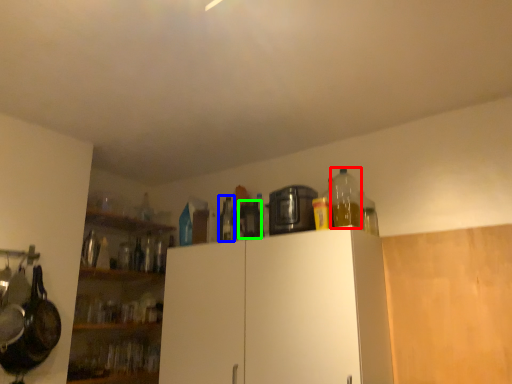
Question: Based on their relative distances, which object is nearer to bottle (highlighted by a red box)? Choose from bottle (highlighted by a blue box) and appliance (highlighted by a green box).

Choices:
 (A) bottle
 (B) appliance

Answer: (B)